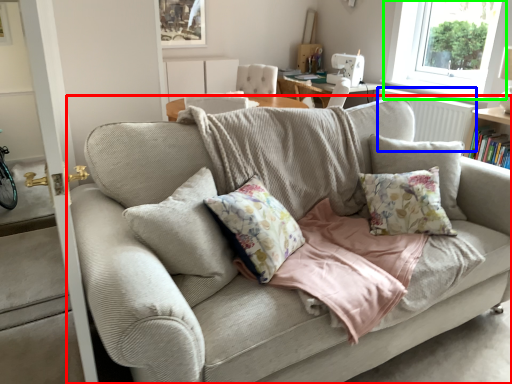
Question: Which object is positioned closest to studio couch (highlighted by a red box)? Select from radiator (highlighted by a blue box) and window (highlighted by a green box).

Choices:
 (A) radiator
 (B) window

Answer: (A)